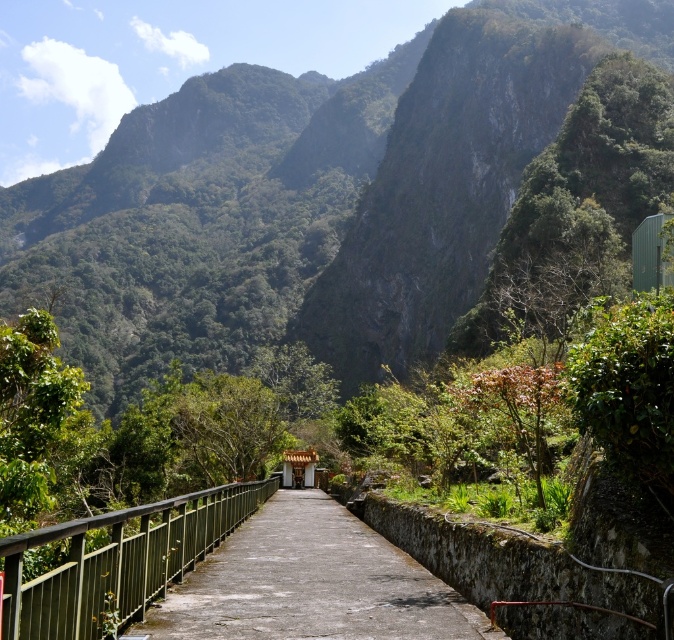
You are a hiker standing on the pathway and looking towards the green leafy mountain at upper center. Can you see the green metal railing at center from your current position?

The green metal railing at center is behind the green leafy mountain at upper center, so it is obstructed from view. Therefore, you cannot see the green metal railing at center from your current position.

You are standing at the starting point of the pathway and want to reach the small structure at the end. Which of the two points, point [301,497] or point [28,596], is closer to you as you begin your walk?

Point [28,596] is closer to you because it is less further to the camera than point [301,497].